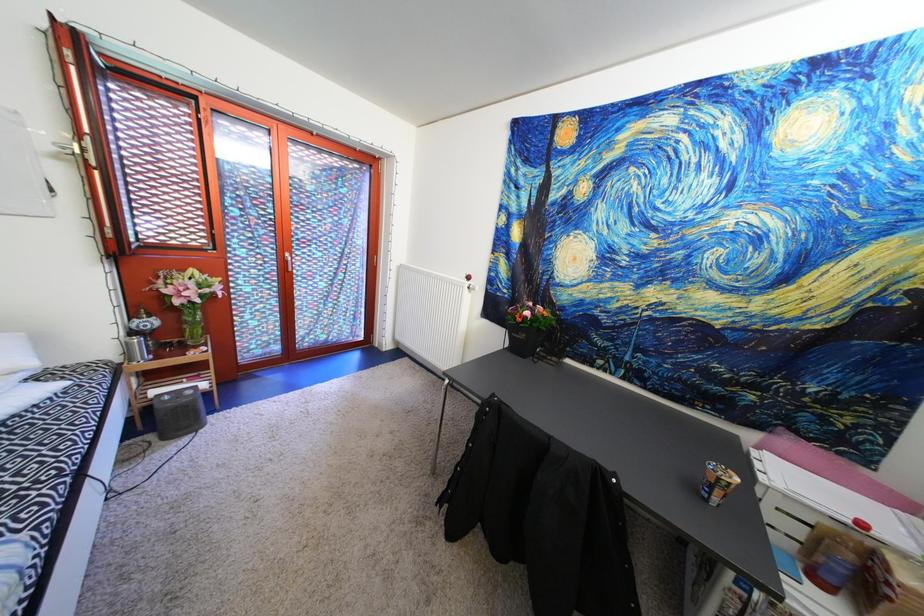
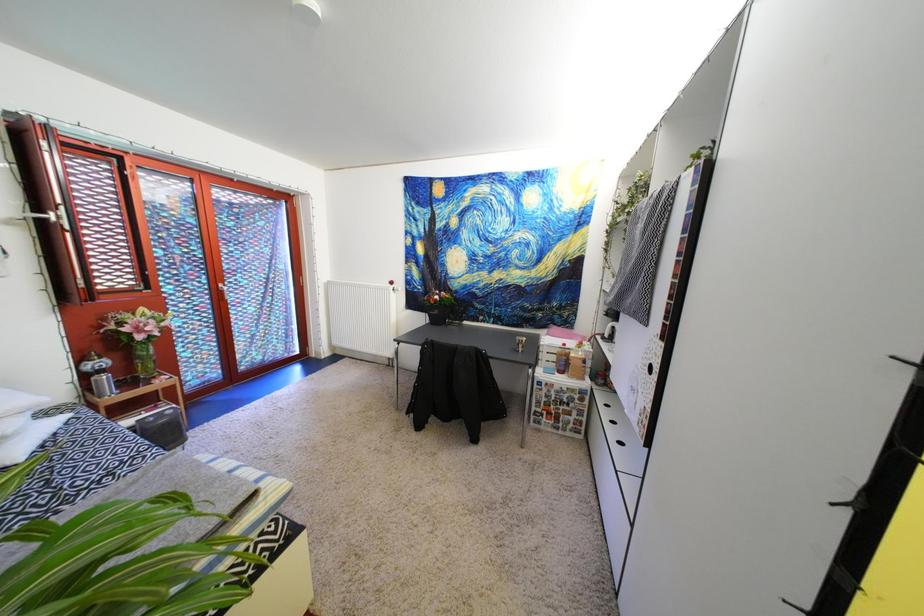
Question: The first image is from the beginning of the video and the second image is from the end. How did the camera likely rotate when shooting the video?

Choices:
 (A) Left
 (B) Right
 (C) Up
 (D) Down

Answer: (B)